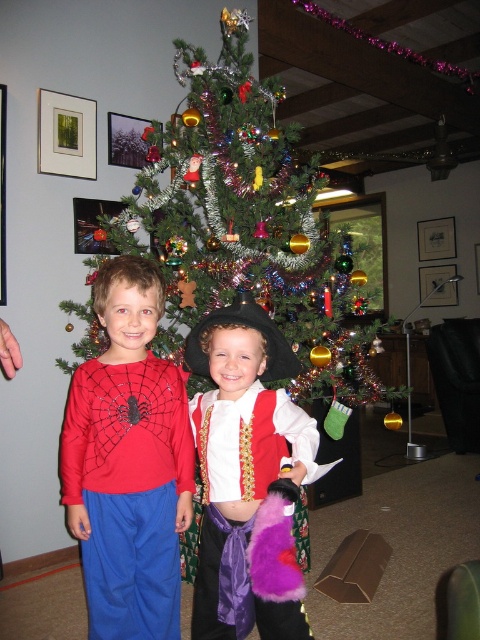
Question: Can you confirm if shiny tinsel christmas tree at center is smaller than matte red sweater at left?

Choices:
 (A) no
 (B) yes

Answer: (A)

Question: Which point is farther to the camera?

Choices:
 (A) (76, 234)
 (B) (136, 616)

Answer: (A)

Question: Among these points, which one is farthest from the camera?

Choices:
 (A) (450, 273)
 (B) (180, 45)

Answer: (A)

Question: Can you confirm if purple satin vest at center is smaller than brushed metal picture frame at upper center?

Choices:
 (A) no
 (B) yes

Answer: (A)

Question: Can you confirm if green matte picture frame at upper left is thinner than brushed metal picture frame at upper center?

Choices:
 (A) yes
 (B) no

Answer: (A)

Question: Which object appears closest to the camera in this image?

Choices:
 (A) shiny tinsel christmas tree at center
 (B) green matte picture frame at upper left

Answer: (A)